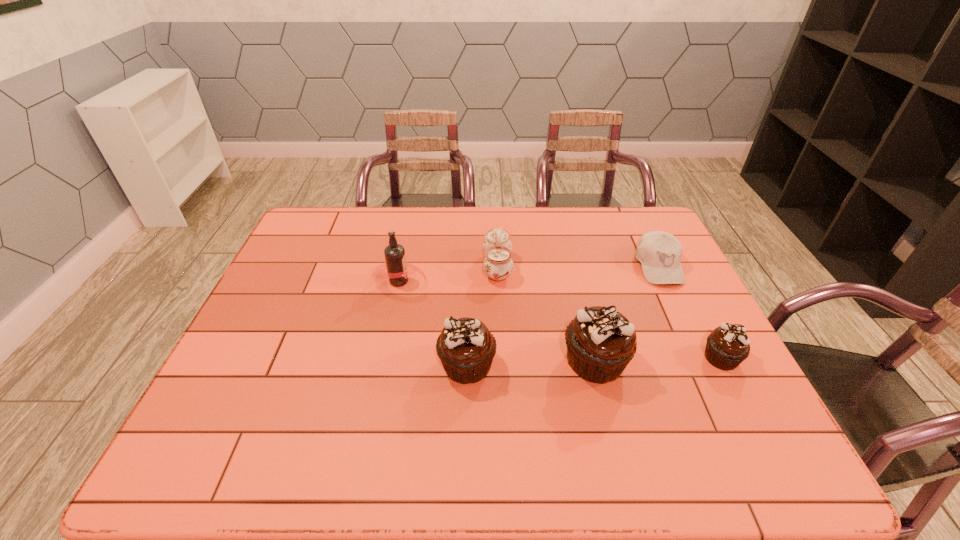
Image resolution: width=960 pixels, height=540 pixels. I want to click on free space between the rightmost cupcake and the baseball cap, so click(x=690, y=312).

Identify which object is the third closest to the baseball cap. Please provide its 2D coordinates. Your answer should be formatted as a tuple, i.e. [(x, y)], where the tuple contains the x and y coordinates of a point satisfying the conditions above.

[(497, 247)]

Locate which object ranks in proximity to the chinaware. Please provide its 2D coordinates. Your answer should be formatted as a tuple, i.e. [(x, y)], where the tuple contains the x and y coordinates of a point satisfying the conditions above.

[(395, 258)]

Locate an element on the screen. cupcake that is the second closest to the shortest cupcake is located at coordinates tap(466, 348).

What are the coordinates of `cupcake that is the closest to the rightmost cupcake` in the screenshot? It's located at (601, 342).

Identify the location of free location that satisfies the following two spatial constraints: 1. on the back side of the leftmost cupcake; 2. on the label of the leftmost object. This screenshot has height=540, width=960. tap(469, 281).

Find the location of `free space that satisfies the following two spatial constraints: 1. on the front-facing side of the baseball cap; 2. by the handle of the chinaware`. free space that satisfies the following two spatial constraints: 1. on the front-facing side of the baseball cap; 2. by the handle of the chinaware is located at coordinates (659, 267).

Locate an element on the screen. vacant area that satisfies the following two spatial constraints: 1. on the front-facing side of the baseball cap; 2. on the left side of the rightmost cupcake is located at coordinates (703, 358).

Where is `free location that satisfies the following two spatial constraints: 1. by the handle of the rightmost cupcake; 2. on the left side of the chinaware`? The height and width of the screenshot is (540, 960). free location that satisfies the following two spatial constraints: 1. by the handle of the rightmost cupcake; 2. on the left side of the chinaware is located at coordinates (502, 358).

Identify the location of free space that satisfies the following two spatial constraints: 1. on the back side of the second cupcake from left to right; 2. by the handle of the chinaware. The height and width of the screenshot is (540, 960). (572, 267).